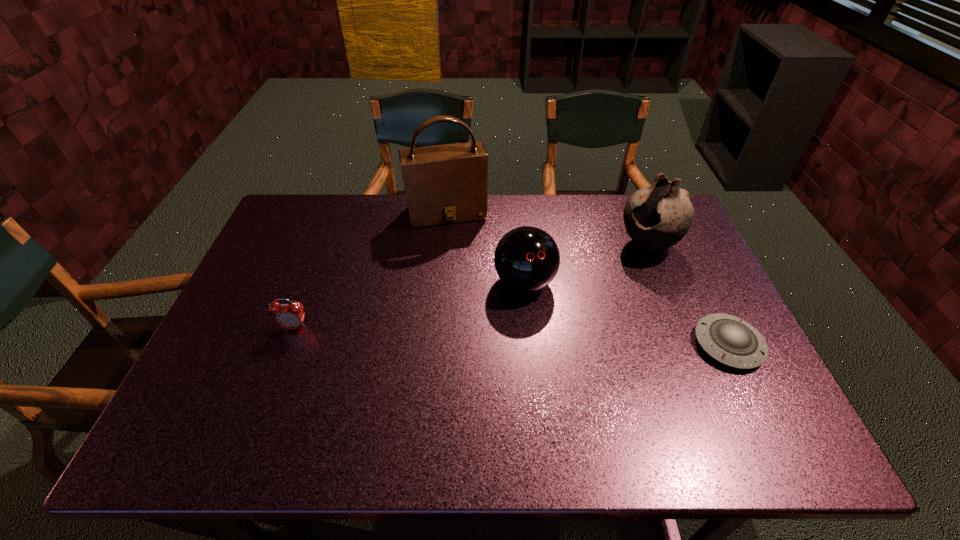
I want to click on vacant spot on the desktop that is between the alarm clock and the saucer and is positioned on the front flap of the tallest object, so click(480, 335).

You are a GUI agent. You are given a task and a screenshot of the screen. Output one action in this format:
    pyautogui.click(x=<x>, y=<y>)
    Task: Click on the vacant spot on the desktop that is between the alarm clock and the saucer and is positioned on the surface of the third object from right to left near the finger holes
    The width and height of the screenshot is (960, 540).
    Given the screenshot: What is the action you would take?
    pyautogui.click(x=549, y=338)

The width and height of the screenshot is (960, 540). In order to click on free spot on the desktop that is between the alarm clock and the saucer and is positioned from the spout of the fourth shortest object in this screenshot , I will do `click(510, 336)`.